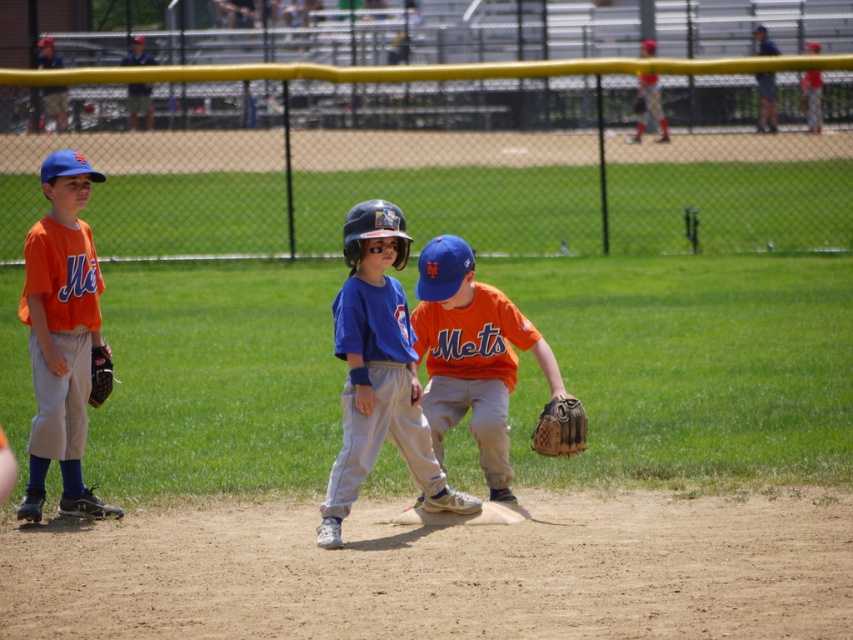
Who is taller, blue matte baseball cap at center or orange matte baseball glove at center?

Standing taller between the two is blue matte baseball cap at center.

From the picture: Can you confirm if blue matte baseball cap at center is positioned to the right of orange matte baseball glove at center?

In fact, blue matte baseball cap at center is to the left of orange matte baseball glove at center.

Locate an element on the screen. Image resolution: width=853 pixels, height=640 pixels. blue matte baseball cap at center is located at coordinates (378, 371).

Which is below, blue matte baseball cap at center or brown leather baseball glove at lower center?

brown leather baseball glove at lower center is lower down.

Can you confirm if blue matte baseball cap at center is positioned above brown leather baseball glove at lower center?

Correct, blue matte baseball cap at center is located above brown leather baseball glove at lower center.

The image size is (853, 640). What do you see at coordinates (378, 371) in the screenshot? I see `blue matte baseball cap at center` at bounding box center [378, 371].

You are a GUI agent. You are given a task and a screenshot of the screen. Output one action in this format:
    pyautogui.click(x=<x>, y=<y>)
    Task: Click on the blue matte baseball cap at center
    This screenshot has width=853, height=640.
    Given the screenshot: What is the action you would take?
    pyautogui.click(x=378, y=371)

Is matte orange jersey at left shorter than brown leather baseball glove at lower center?

No, matte orange jersey at left is not shorter than brown leather baseball glove at lower center.

Does point (53, 225) come closer to viewer compared to point (572, 448)?

That is False.

The height and width of the screenshot is (640, 853). Identify the location of matte orange jersey at left. (61, 333).